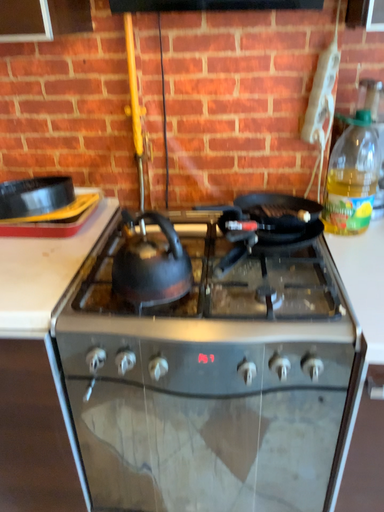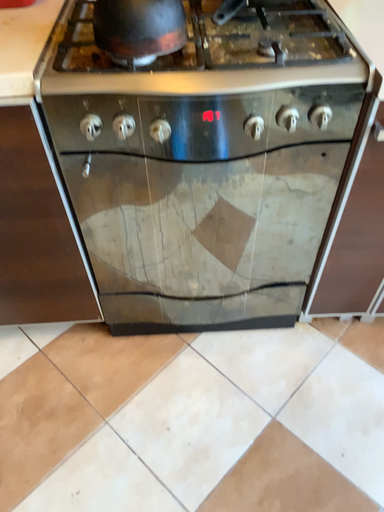
Question: Which way did the camera rotate in the video?

Choices:
 (A) rotated left
 (B) rotated right

Answer: (B)